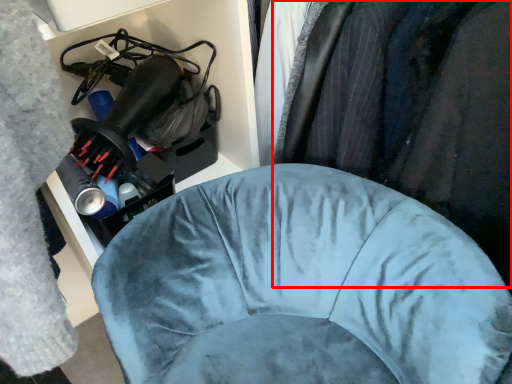
Question: Where is clothing (annotated by the red box) located in relation to furniture in the image?

Choices:
 (A) left
 (B) right

Answer: (B)